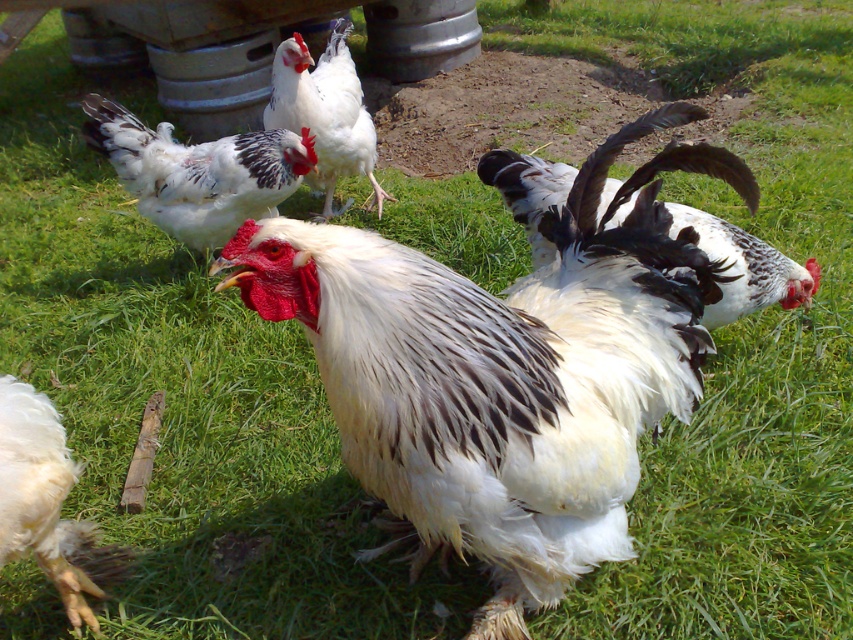
Question: Is white fluffy chicken at center to the left of white fluffy feather at lower left from the viewer's perspective?

Choices:
 (A) yes
 (B) no

Answer: (A)

Question: Which of the following is the closest to the observer?

Choices:
 (A) white glossy rooster at center
 (B) white fluffy feather at lower left

Answer: (A)

Question: Which object appears closest to the camera in this image?

Choices:
 (A) white fluffy feather at lower left
 (B) white glossy rooster at center
 (C) white fluffy chicken at center

Answer: (B)

Question: Which point is farther to the camera?

Choices:
 (A) white fluffy chicken at upper center
 (B) white fluffy chicken at center
 (C) white glossy rooster at center
 (D) white fluffy feather at lower left

Answer: (A)

Question: Where is white glossy rooster at center located in relation to white fluffy chicken at upper center in the image?

Choices:
 (A) left
 (B) right

Answer: (B)

Question: Does white glossy rooster at center lie in front of white fluffy feather at lower left?

Choices:
 (A) yes
 (B) no

Answer: (A)